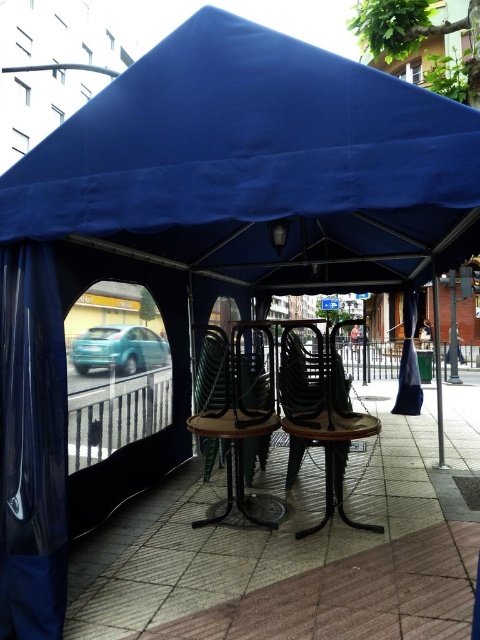
You are a guest at this outdoor seating area and want to sit down. There is a metallic brown chair at center and a blue fabric curtain at right. Which object is closer to the teal car visible through the railing?

The metallic brown chair at center is closer to the teal car visible through the railing because it is positioned to the left of the blue fabric curtain at right, which is farther away from the railing where the car is located.

You are a painter who needs to set up an easel in this outdoor area. You want to ensure there is enough vertical space between the blue sheer curtain at left and the wooden chair at center to avoid hitting the curtain when raising the easel. Is the vertical space between them sufficient?

The blue sheer curtain at left is taller than the wooden chair at center, so there is enough vertical space between them to avoid hitting the curtain when raising the easel.

You are a guest at this outdoor seating area and want to sit down. Which object would block your view of the teal car through the dark metal railing? Please choose between the blue sheer curtain at left and the wooden chair at center.

The blue sheer curtain at left is positioned over the wooden chair at center, so the blue sheer curtain at left would block your view of the teal car through the dark metal railing.